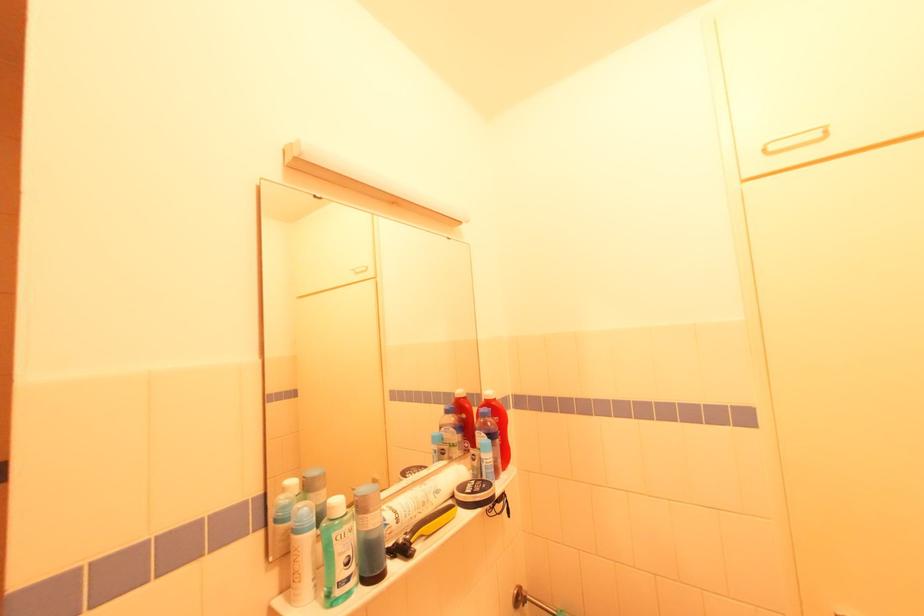
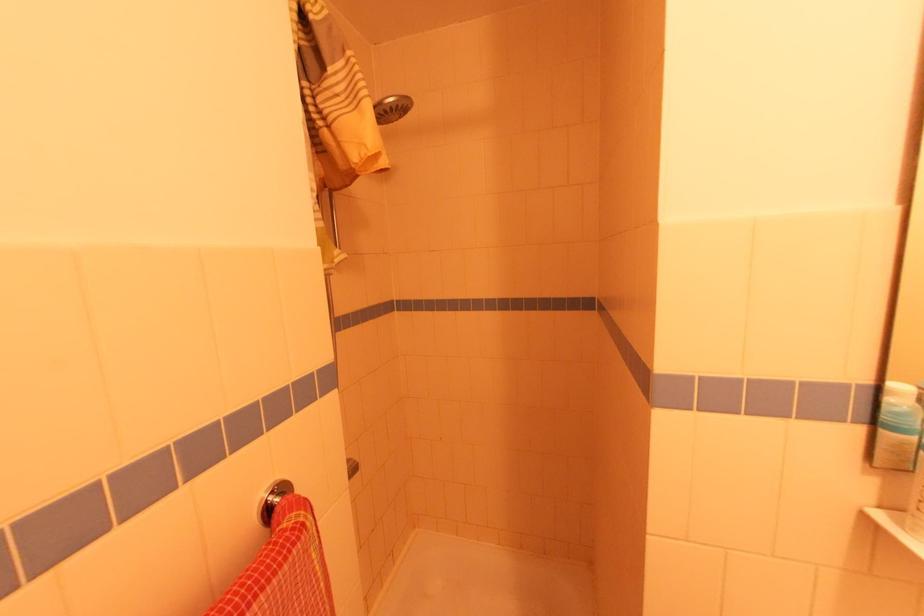
In the second image, find the point that corresponds to point 289,531 in the first image.

(906, 445)